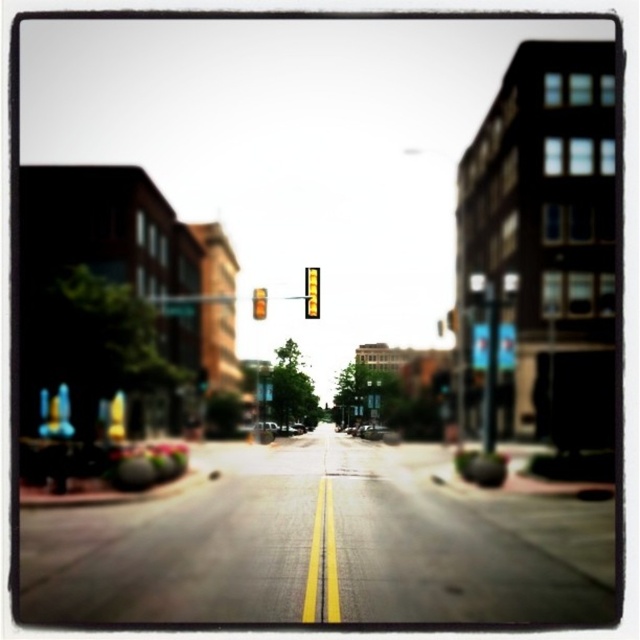
Question: Does yellow reflective sign at center have a smaller size compared to metallic silver car at center?

Choices:
 (A) yes
 (B) no

Answer: (A)

Question: Which point appears farthest from the camera in this image?

Choices:
 (A) (512, 362)
 (B) (184, 305)
 (C) (266, 289)

Answer: (C)

Question: Is blue reflective sign at center above yellow reflective sign at center?

Choices:
 (A) no
 (B) yes

Answer: (A)

Question: Which object is the closest to the amber glass traffic light at center?

Choices:
 (A) blue reflective sign at center
 (B) yellow matte traffic light at center
 (C) metallic pole at center-right
 (D) yellow reflective sign at center

Answer: (B)

Question: Which object appears closest to the camera in this image?

Choices:
 (A) metallic silver car at center
 (B) blue reflective sign at center
 (C) yellow matte traffic light at center

Answer: (C)

Question: Is yellow reflective sign at center closer to the viewer compared to amber glass traffic light at center?

Choices:
 (A) yes
 (B) no

Answer: (B)